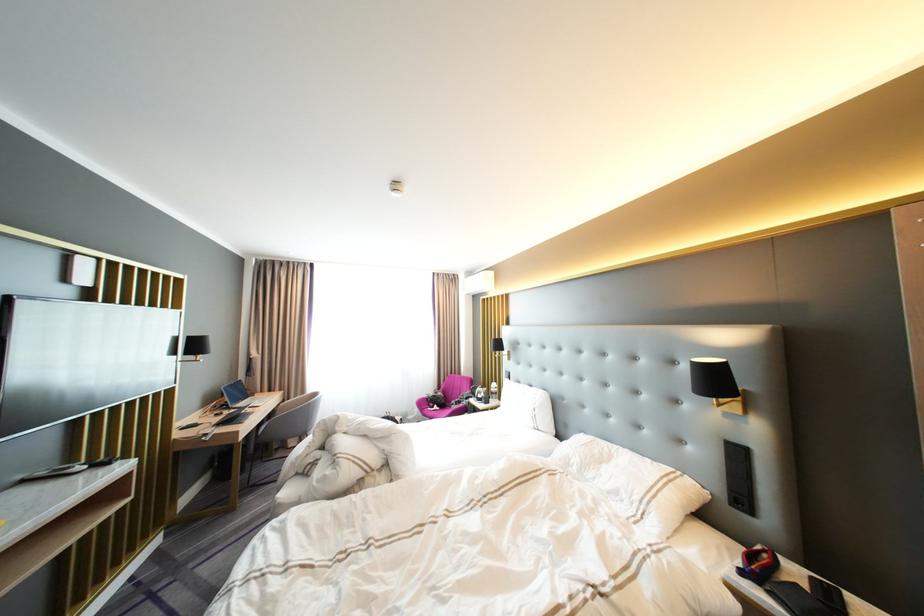
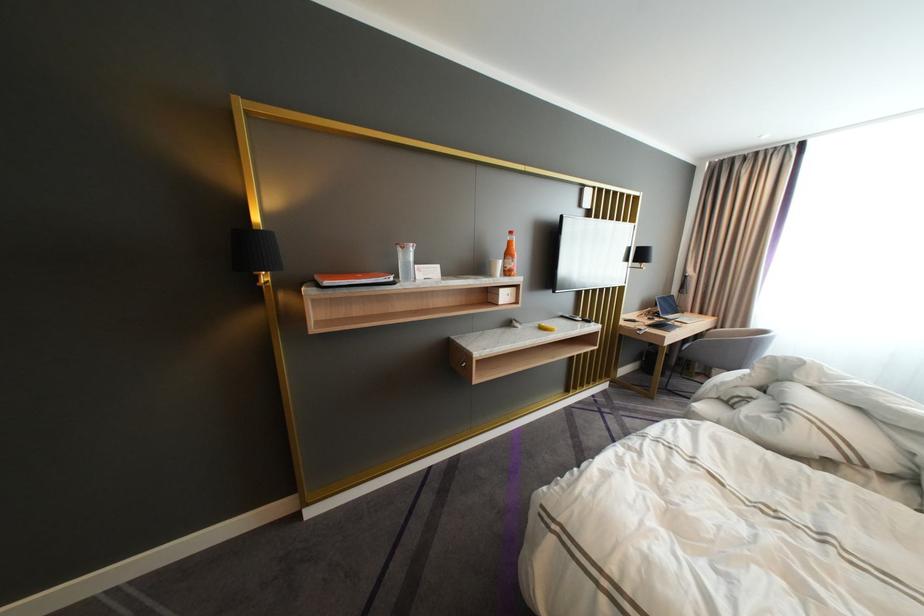
Locate, in the second image, the point that corresponds to the point at 283,415 in the first image.

(710, 338)